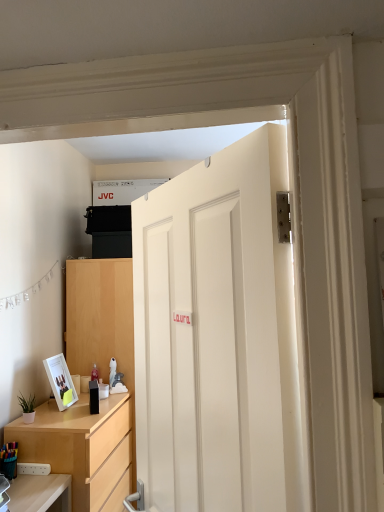
I want to click on free space in front of white glossy picture frame at lower left, so click(51, 415).